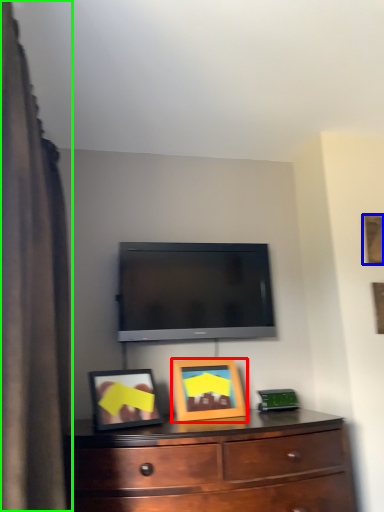
Question: Which is nearer to the picture frame (highlighted by a red box)? picture frame (highlighted by a blue box) or curtain (highlighted by a green box).

Choices:
 (A) picture frame
 (B) curtain

Answer: (B)